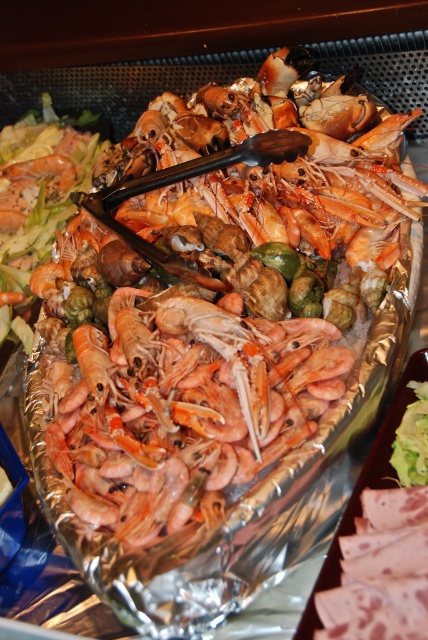
Question: Does orange matte shrimp at center have a smaller size compared to pink matte shrimp at center?

Choices:
 (A) no
 (B) yes

Answer: (A)

Question: Among these points, which one is nearest to the camera?

Choices:
 (A) (171, 422)
 (B) (336, 188)

Answer: (A)

Question: Which of the following is the farthest from the observer?

Choices:
 (A) pink matte shrimp at center
 (B) orange matte shrimp at center

Answer: (B)

Question: Observing the image, what is the correct spatial positioning of orange matte shrimp at center in reference to pink matte shrimp at center?

Choices:
 (A) right
 (B) left

Answer: (A)

Question: Which point is closer to the camera?

Choices:
 (A) pink matte shrimp at center
 (B) orange matte shrimp at center

Answer: (A)

Question: Can you confirm if orange matte shrimp at center is smaller than pink matte shrimp at center?

Choices:
 (A) yes
 (B) no

Answer: (B)